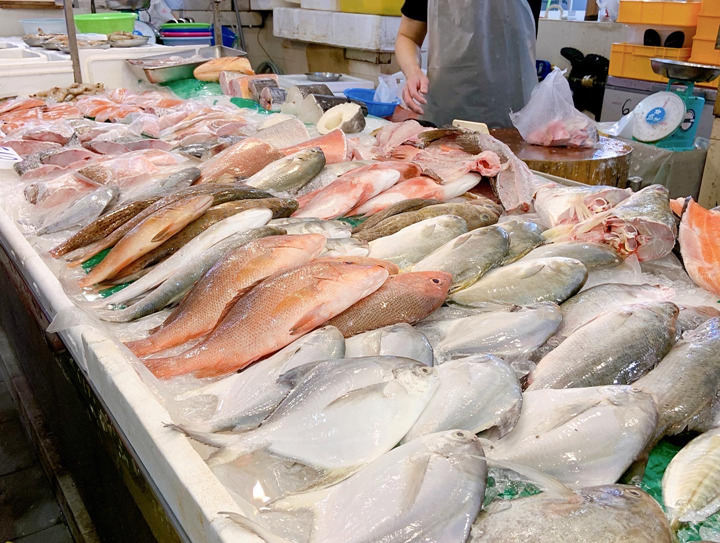
In order to click on shelf in this screenshot , I will do `click(148, 413)`.